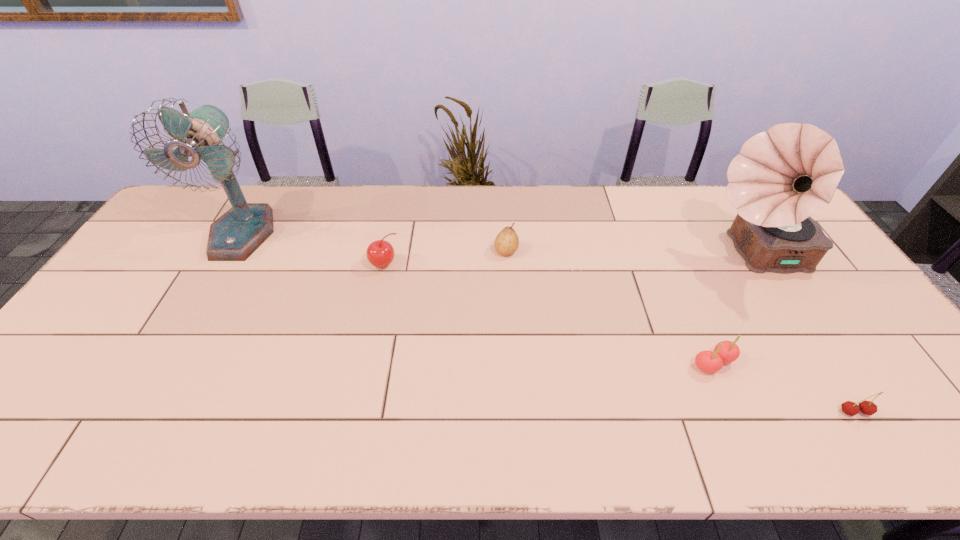
Locate an element on the screen. The height and width of the screenshot is (540, 960). free point between the record player and the pear is located at coordinates (630, 253).

The height and width of the screenshot is (540, 960). I want to click on vacant space in between the nearest cherry and the farthest cherry, so click(x=619, y=338).

Where is `vacant space in between the third object from right to left and the record player`? vacant space in between the third object from right to left and the record player is located at coordinates [x=733, y=309].

The image size is (960, 540). Identify the location of free space between the third object from left to right and the fifth object from right to left. (445, 258).

Where is `vacant area that lies between the second farthest cherry and the fourth object from right to left`? The image size is (960, 540). vacant area that lies between the second farthest cherry and the fourth object from right to left is located at coordinates (610, 307).

I want to click on vacant region between the leftmost cherry and the nearest object, so click(x=619, y=338).

This screenshot has height=540, width=960. Find the location of `free space that is in between the fan and the second cherry from left to right`. free space that is in between the fan and the second cherry from left to right is located at coordinates (478, 299).

Image resolution: width=960 pixels, height=540 pixels. Identify the location of vacant area that lies between the record player and the leftmost cherry. (569, 259).

Where is `object that stands as the second closest to the record player`? This screenshot has width=960, height=540. object that stands as the second closest to the record player is located at coordinates [849, 408].

Locate an element on the screen. The image size is (960, 540). the third closest object relative to the third object from right to left is located at coordinates (506, 243).